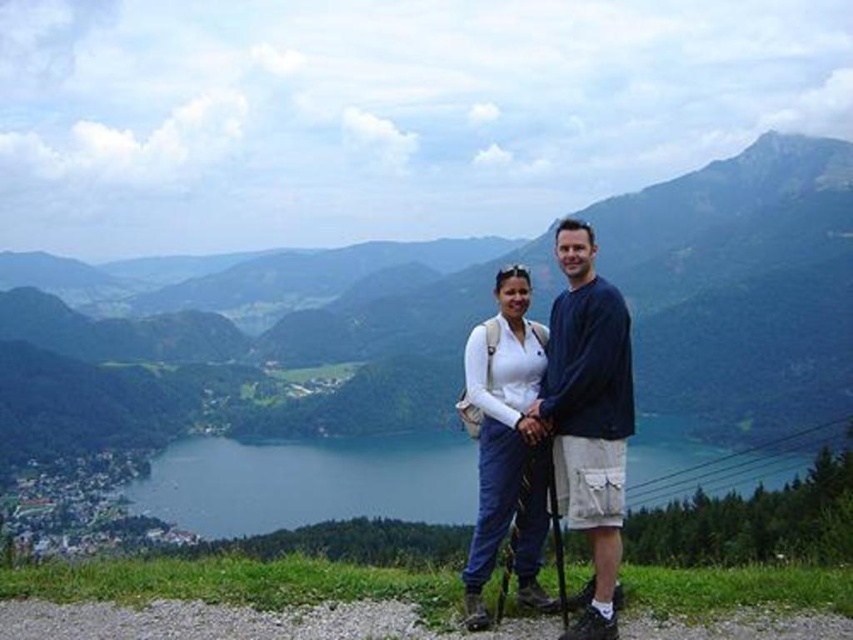
Question: Estimate the real-world distances between objects in this image. Which object is farther from the black rubber ski pole at center?

Choices:
 (A) blue water at center
 (B) black matte ski pole at lower center
 (C) matte white shirt at center
 (D) white matte jacket at center

Answer: (A)

Question: Estimate the real-world distances between objects in this image. Which object is closer to the matte white shirt at center?

Choices:
 (A) blue water at center
 (B) black rubber ski pole at center
 (C) green grassy mountain at center
 (D) black matte ski pole at lower center

Answer: (D)

Question: Is green grassy mountain at center below black matte ski pole at lower center?

Choices:
 (A) no
 (B) yes

Answer: (A)

Question: Which point is closer to the camera taking this photo?

Choices:
 (A) (453, 433)
 (B) (524, 483)

Answer: (B)

Question: Can you confirm if green grassy mountain at center is positioned below white matte jacket at center?

Choices:
 (A) yes
 (B) no

Answer: (B)

Question: Is blue water at center closer to the viewer compared to black rubber ski pole at center?

Choices:
 (A) no
 (B) yes

Answer: (A)